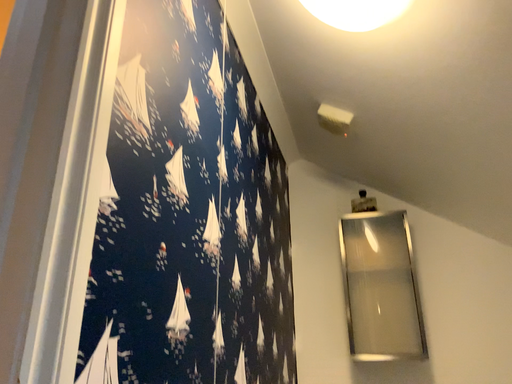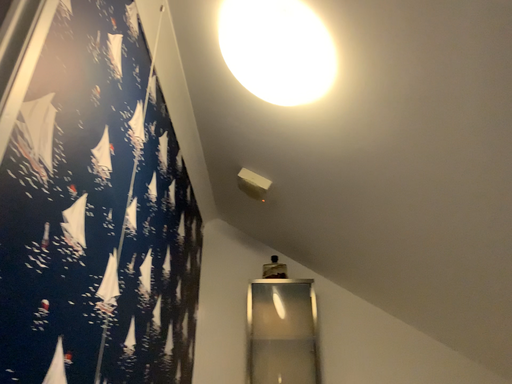
Question: Which way did the camera rotate in the video?

Choices:
 (A) rotated right
 (B) rotated left

Answer: (A)